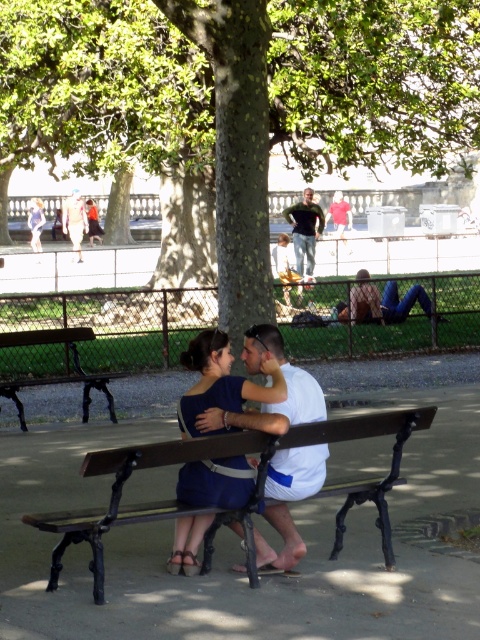
Looking at this image, which of these two, green textured tree at center or wooden bench at center, stands taller?

Standing taller between the two is green textured tree at center.

Who is shorter, green textured tree at center or wooden bench at center?

With less height is wooden bench at center.

At what (x,y) coordinates should I click in order to perform the action: click on green textured tree at center. Please return your answer as a coordinate pair (x, y). Looking at the image, I should click on (238, 100).

Is point (257, 493) behind point (68, 358)?

No, (257, 493) is in front of (68, 358).

At what (x,y) coordinates should I click in order to perform the action: click on wooden bench at center. Please return your answer as a coordinate pair (x, y). Looking at the image, I should click on (228, 458).

Is point (192, 532) positioned after point (101, 387)?

No.

Between matte blue dress at center and wooden bench at left, which one is positioned lower?

Positioned lower is wooden bench at left.

Locate an element on the screen. matte blue dress at center is located at coordinates (219, 384).